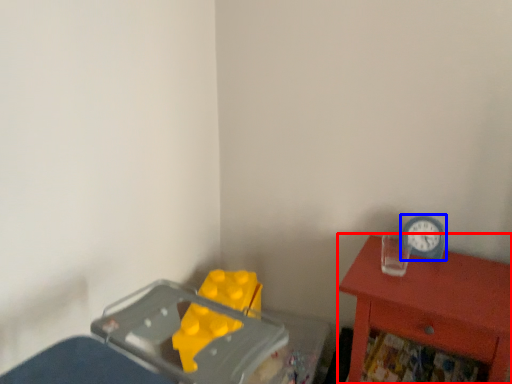
Question: Which point is closer to the camera, nightstand (highlighted by a red box) or clock (highlighted by a blue box)?

Choices:
 (A) nightstand
 (B) clock

Answer: (A)